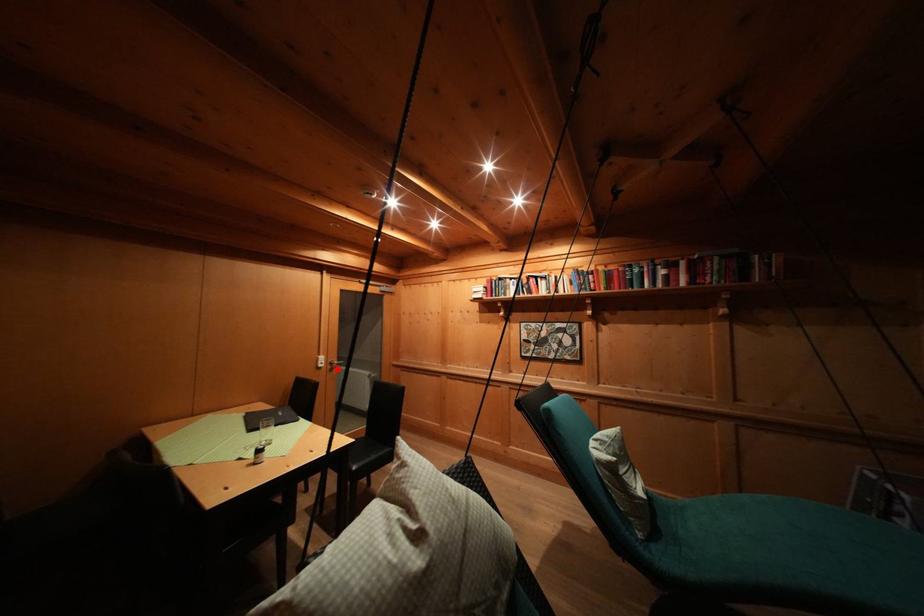
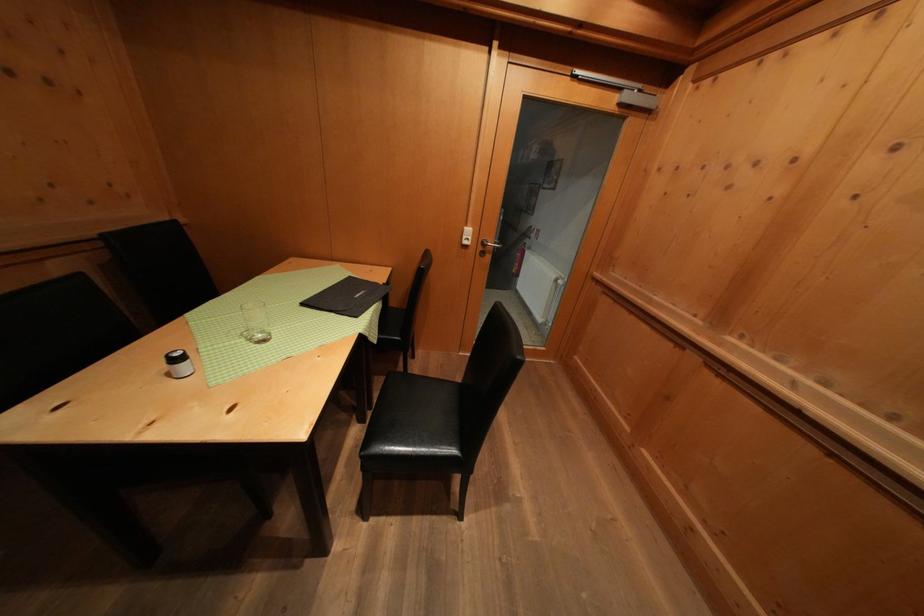
Question: I am providing you with two images of the same scene from different viewpoints. In image1, a red point is highlighted. Considering the same 3D point in image2, which of the following is correct?

Choices:
 (A) It is closer
 (B) It is farther

Answer: (A)